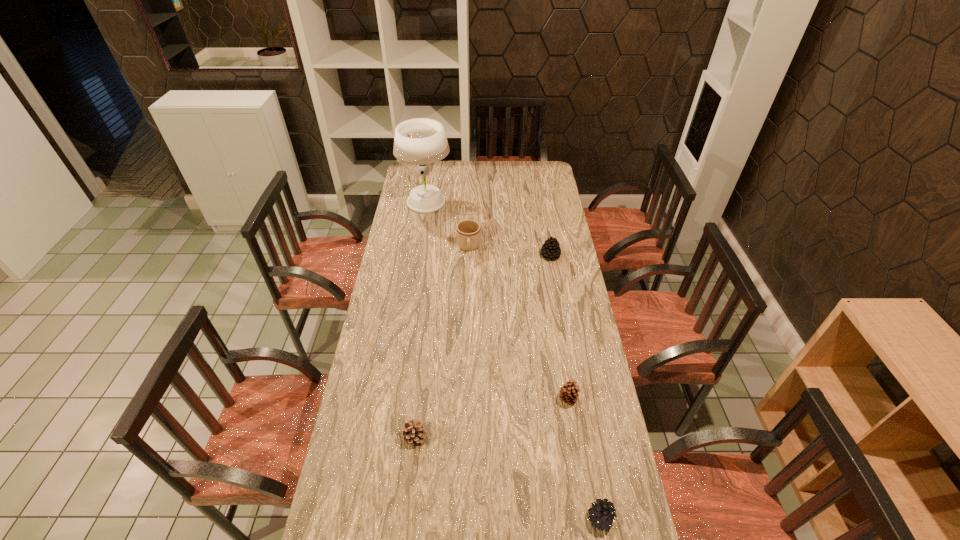
The image size is (960, 540). Identify the location of free space between the third nearest object and the lamp. (497, 301).

This screenshot has width=960, height=540. I want to click on empty space between the second nearest pinecone and the nearest object, so click(507, 477).

What are the coordinates of `free space between the farthest pinecone and the tallest object` in the screenshot? It's located at (489, 229).

You are a GUI agent. You are given a task and a screenshot of the screen. Output one action in this format:
    pyautogui.click(x=<x>, y=<y>)
    Task: Click on the vacant area between the fourth farthest object and the fifth farthest object
    The image size is (960, 540).
    Given the screenshot: What is the action you would take?
    pyautogui.click(x=491, y=418)

At what (x,y) coordinates should I click in order to perform the action: click on vacant area that lies between the farthest pinecone and the third nearest object. Please return your answer as a coordinate pair (x, y). Looking at the image, I should click on pyautogui.click(x=559, y=327).

Locate an element on the screen. This screenshot has width=960, height=540. free area in between the tallest object and the third object from left to right is located at coordinates (447, 225).

Where is `empty location between the second nearest pinecone and the third object from left to right`? This screenshot has height=540, width=960. empty location between the second nearest pinecone and the third object from left to right is located at coordinates (442, 342).

Where is `empty space that is in between the fourth object from right to left and the second nearest pinecone`? This screenshot has width=960, height=540. empty space that is in between the fourth object from right to left and the second nearest pinecone is located at coordinates (442, 342).

What are the coordinates of `free space between the tallest object and the second nearest pinecone` in the screenshot? It's located at (420, 320).

The width and height of the screenshot is (960, 540). In order to click on the second closest object to the second farthest pinecone in this screenshot , I will do `click(413, 433)`.